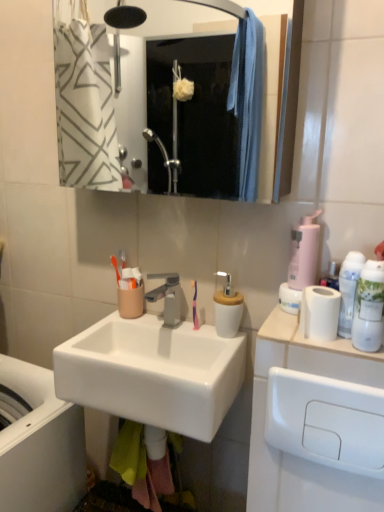
Question: Is white plastic drawer at lower right further to camera compared to purple plastic toothbrush at center?

Choices:
 (A) no
 (B) yes

Answer: (A)

Question: Can you confirm if white plastic drawer at lower right is taller than purple plastic toothbrush at center?

Choices:
 (A) no
 (B) yes

Answer: (B)

Question: Is white plastic drawer at lower right oriented away from purple plastic toothbrush at center?

Choices:
 (A) yes
 (B) no

Answer: (B)

Question: Is white plastic drawer at lower right beside purple plastic toothbrush at center?

Choices:
 (A) no
 (B) yes

Answer: (A)

Question: From a real-world perspective, is white plastic drawer at lower right under purple plastic toothbrush at center?

Choices:
 (A) yes
 (B) no

Answer: (A)

Question: Can you confirm if white plastic drawer at lower right is positioned to the right of purple plastic toothbrush at center?

Choices:
 (A) no
 (B) yes

Answer: (B)

Question: From the image's perspective, is metallic silver mirror at upper center below white plastic drawer at lower right?

Choices:
 (A) no
 (B) yes

Answer: (A)

Question: Would you say metallic silver mirror at upper center is a long distance from white plastic drawer at lower right?

Choices:
 (A) yes
 (B) no

Answer: (A)

Question: Is white plastic drawer at lower right located within metallic silver mirror at upper center?

Choices:
 (A) yes
 (B) no

Answer: (B)

Question: Could you tell me if metallic silver mirror at upper center is turned towards white plastic drawer at lower right?

Choices:
 (A) no
 (B) yes

Answer: (A)

Question: Considering the relative positions of metallic silver mirror at upper center and white plastic drawer at lower right in the image provided, is metallic silver mirror at upper center to the left of white plastic drawer at lower right from the viewer's perspective?

Choices:
 (A) no
 (B) yes

Answer: (B)

Question: From a real-world perspective, is metallic silver mirror at upper center located higher than white plastic drawer at lower right?

Choices:
 (A) yes
 (B) no

Answer: (A)

Question: Can you confirm if white glossy mouthwash at right, which is the second mouthwash in back-to-front order, is taller than metallic silver mirror at upper center?

Choices:
 (A) yes
 (B) no

Answer: (B)